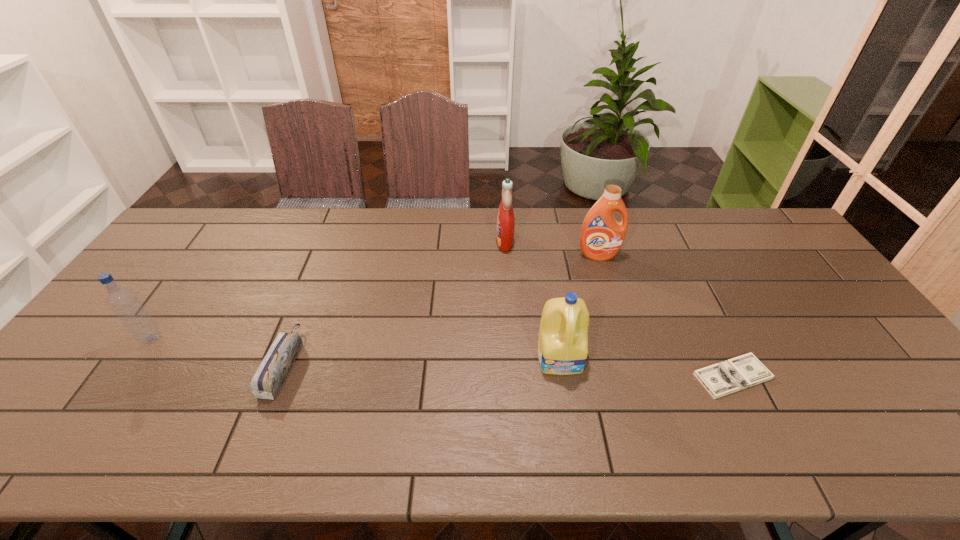
The image size is (960, 540). Find the location of `blank space located 0.130m on the front surface of the third object from left to right`. blank space located 0.130m on the front surface of the third object from left to right is located at coordinates (457, 241).

Identify the location of free space located 0.230m on the front surface of the third object from left to right. This screenshot has height=540, width=960. (428, 241).

Find the location of a particular element. This screenshot has width=960, height=540. vacant space situated on the front surface of the third object from left to right is located at coordinates (393, 241).

Image resolution: width=960 pixels, height=540 pixels. I want to click on free location located 0.150m on the back of the water bottle, so click(184, 292).

Where is `vacant region located 0.140m on the label of the nearest detergent`? This screenshot has height=540, width=960. vacant region located 0.140m on the label of the nearest detergent is located at coordinates (572, 429).

Where is `free space located 0.350m on the left of the second object from left to right`? The height and width of the screenshot is (540, 960). free space located 0.350m on the left of the second object from left to right is located at coordinates coord(132,364).

Where is `vacant area located on the back of the dollar`? This screenshot has height=540, width=960. vacant area located on the back of the dollar is located at coordinates (683, 274).

Find the location of a particular element. Image resolution: width=960 pixels, height=540 pixels. object that is at the left edge is located at coordinates (124, 303).

In the image, there is a desktop. Where is `vacant space at the far edge`? The height and width of the screenshot is (540, 960). vacant space at the far edge is located at coordinates (404, 230).

Where is `free location at the left edge of the desktop`? Image resolution: width=960 pixels, height=540 pixels. free location at the left edge of the desktop is located at coordinates (153, 281).